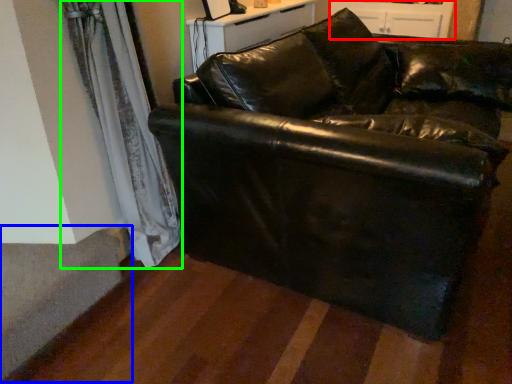
Question: Based on their relative distances, which object is farther from dresser (highlighted by a red box)? Choose from stairwell (highlighted by a blue box) and curtain (highlighted by a green box).

Choices:
 (A) stairwell
 (B) curtain

Answer: (A)